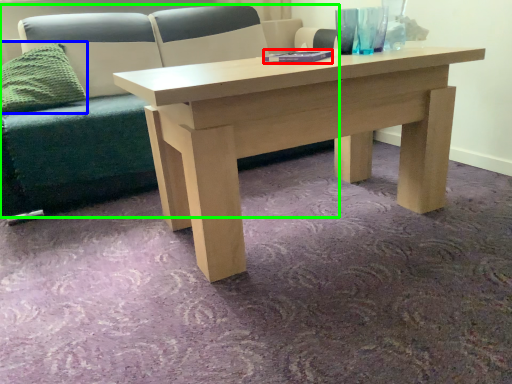
Question: Which object is positioned farthest from book (highlighted by a red box)? Select from pillow (highlighted by a blue box) and studio couch (highlighted by a green box).

Choices:
 (A) pillow
 (B) studio couch

Answer: (A)